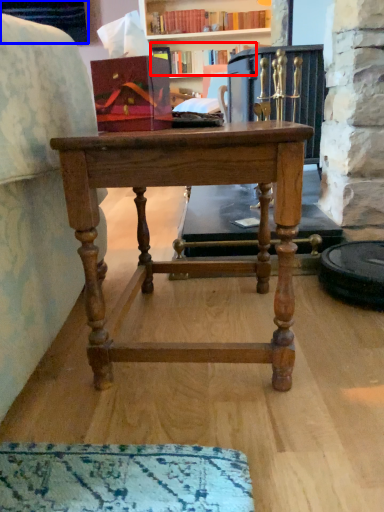
Question: Which object is further to the camera taking this photo, book (highlighted by a red box) or cabinetry (highlighted by a blue box)?

Choices:
 (A) book
 (B) cabinetry

Answer: (A)